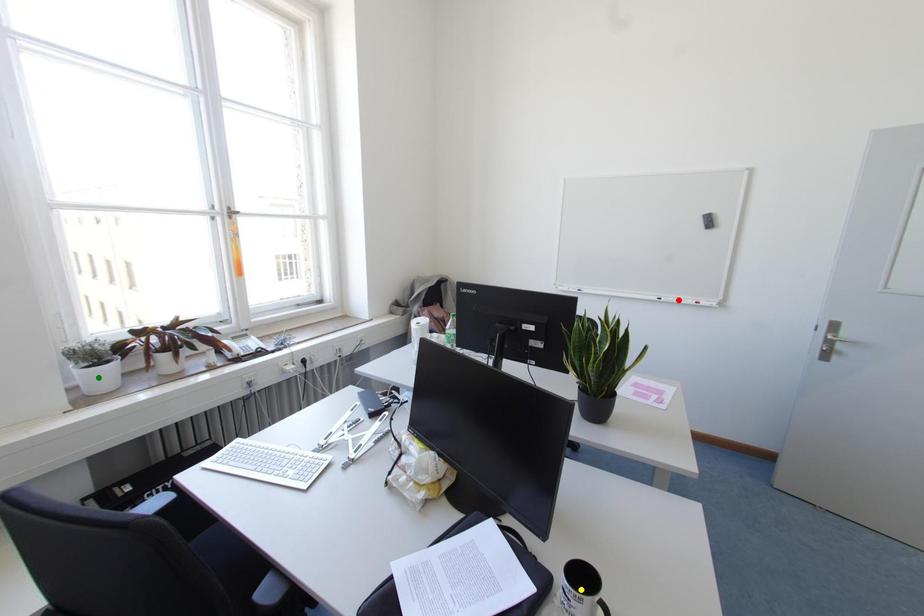
Order these from nearest to farthest:
- red point
- yellow point
- green point

red point → green point → yellow point